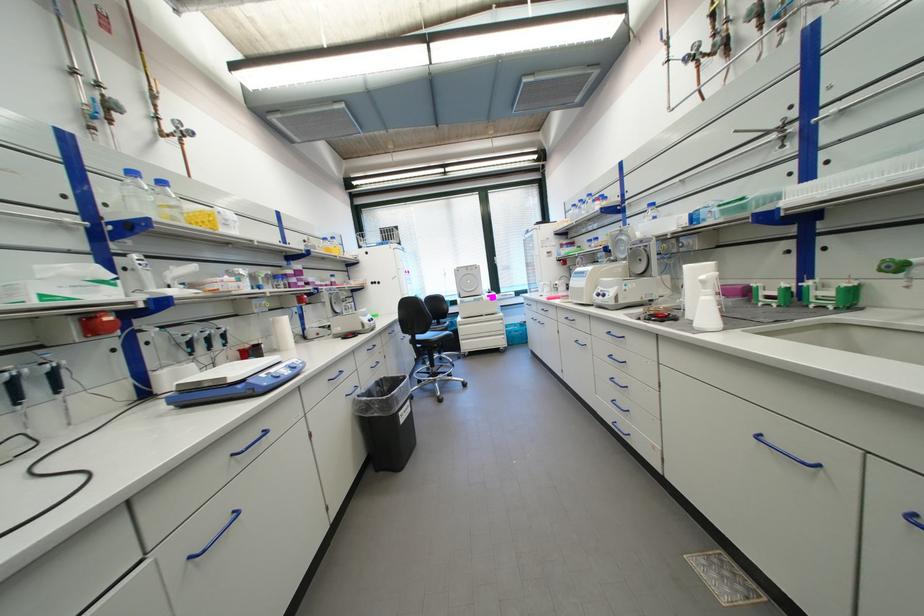
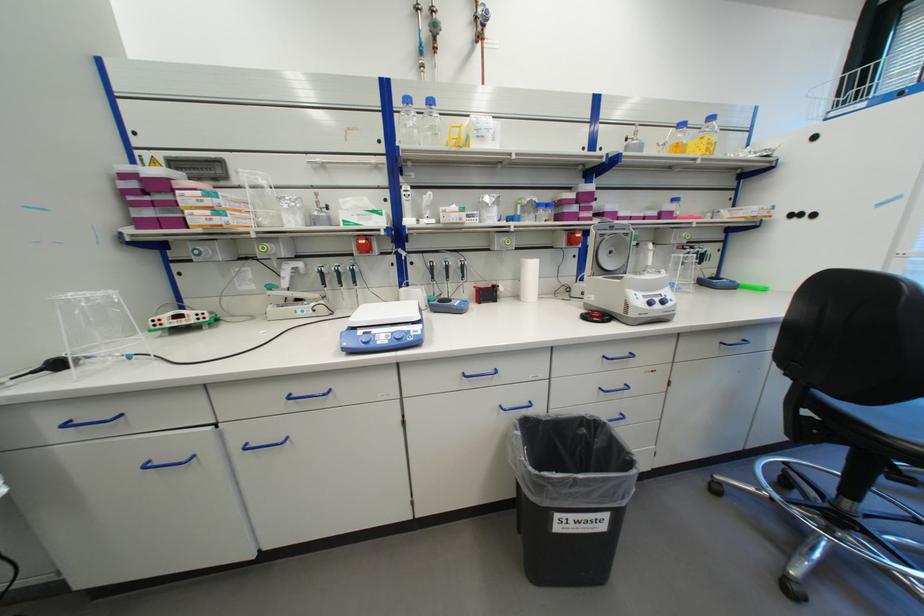
Locate, in the second image, the point that corresponds to [239,456] in the first image.

(298, 395)